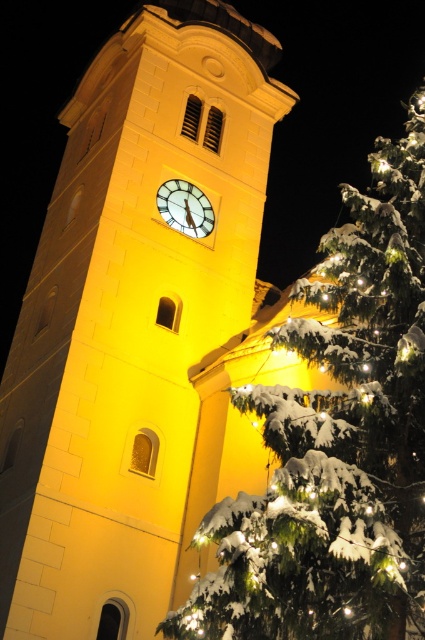
Does point (125, 536) come behind point (374, 532)?

Yes, point (125, 536) is behind point (374, 532).

I want to click on yellow stone clock tower at center, so click(136, 326).

In the scene shown: Who is more distant from viewer, (87, 218) or (221, 541)?

Point (87, 218)

At what (x,y) coordinates should I click in order to perform the action: click on yellow stone clock tower at center. Please return your answer as a coordinate pair (x, y). The width and height of the screenshot is (425, 640). Looking at the image, I should click on (136, 326).

Which is in front, point (158, 220) or point (204, 204)?

Point (158, 220) is in front.

Is yellow stone clock tower at center below white glossy clock at center?

Yes, yellow stone clock tower at center is below white glossy clock at center.

The height and width of the screenshot is (640, 425). Find the location of `yellow stone clock tower at center`. yellow stone clock tower at center is located at coordinates (x=136, y=326).

The image size is (425, 640). Find the location of `yellow stone clock tower at center`. yellow stone clock tower at center is located at coordinates (136, 326).

Describe the element at coordinates (337, 442) in the screenshot. The height and width of the screenshot is (640, 425). I see `snow-covered pine at right` at that location.

Identify the location of snow-covered pine at right. The image size is (425, 640). (337, 442).